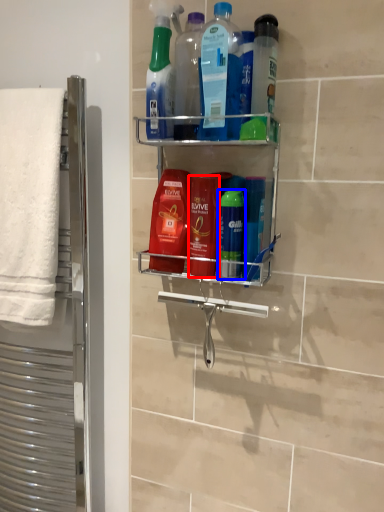
Question: Among these objects, which one is nearest to the camera, mouthwash (highlighted by a red box) or mouthwash (highlighted by a blue box)?

Choices:
 (A) mouthwash
 (B) mouthwash

Answer: (B)